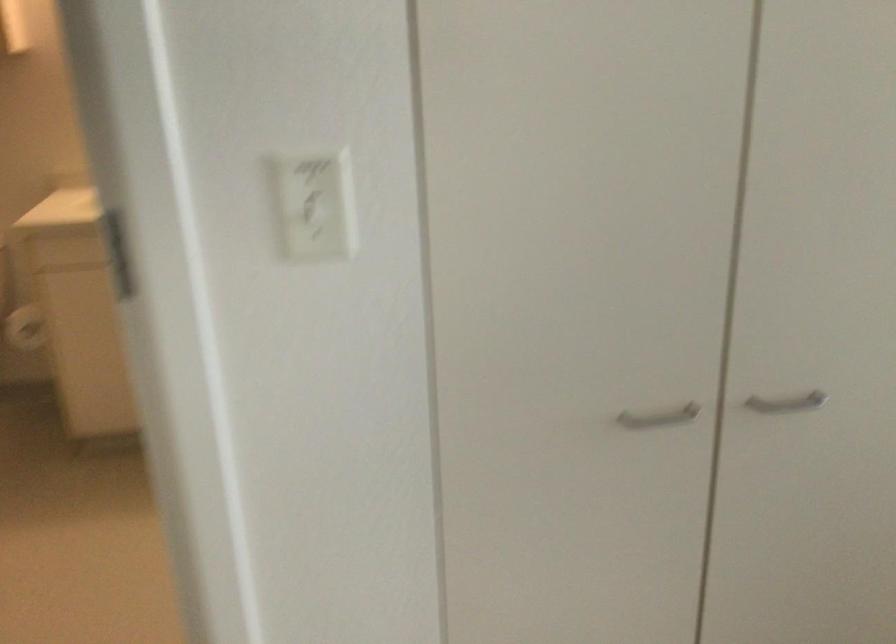
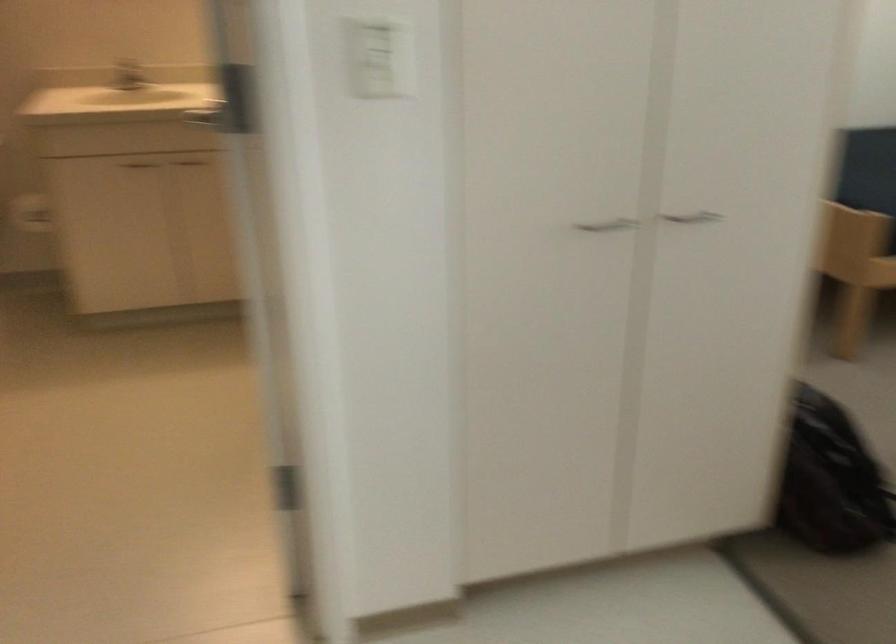
Question: I am providing you with two images of the same scene from different viewpoints. After the viewpoint changes to image2, which objects are now occluded?

Choices:
 (A) silver cabinet handle
 (B) white light switch
 (C) chair sitting surface
 (D) none of these

Answer: (D)